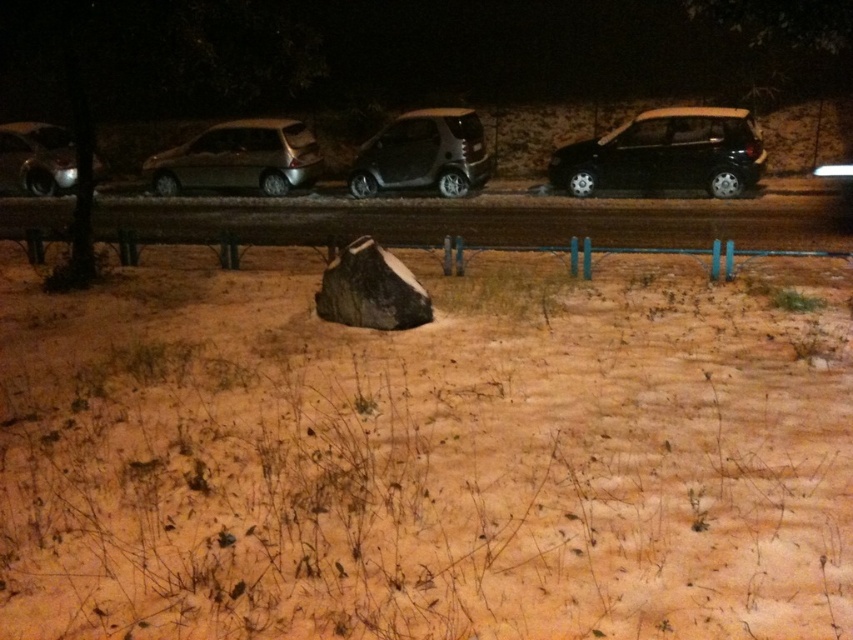
Which is in front, point (622, 145) or point (305, 152)?

Positioned in front is point (622, 145).

Which is below, black matte hatchback at right or metallic silver hatchback at center?

Positioned lower is black matte hatchback at right.

Between point (561, 166) and point (212, 134), which one is positioned in front?

Point (561, 166) is in front.

Identify the location of black matte hatchback at right. Image resolution: width=853 pixels, height=640 pixels. (666, 154).

Which of these two, black matte hatchback at right or satin black car at center, stands taller?

satin black car at center

Is black matte hatchback at right smaller than satin black car at center?

Actually, black matte hatchback at right might be larger than satin black car at center.

Find the location of `black matte hatchback at right`. black matte hatchback at right is located at coordinates (666, 154).

The width and height of the screenshot is (853, 640). I want to click on black matte hatchback at right, so click(x=666, y=154).

Can you confirm if brown sandy dirt at center is bigger than metallic silver hatchback at center?

Actually, brown sandy dirt at center might be smaller than metallic silver hatchback at center.

This screenshot has width=853, height=640. In order to click on brown sandy dirt at center in this screenshot , I will do `click(426, 454)`.